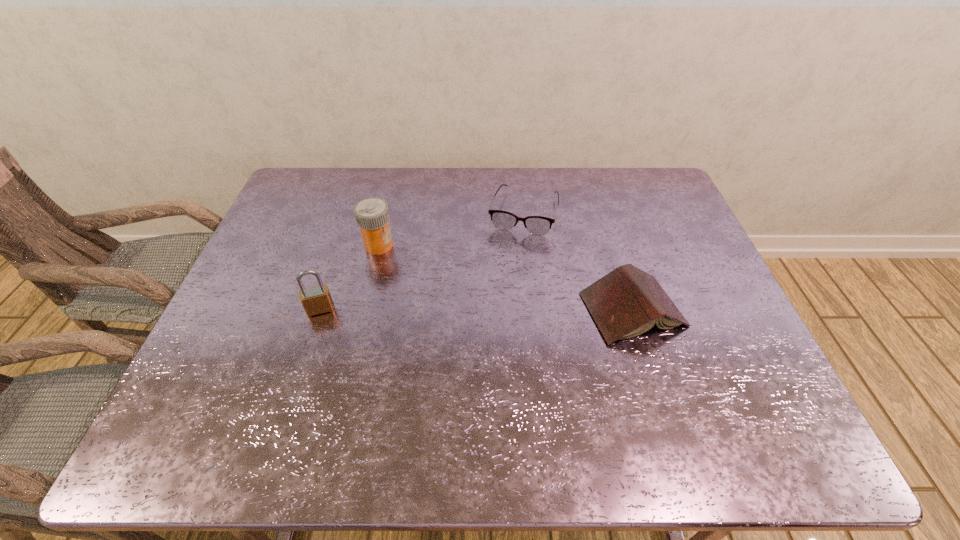
Identify which object is the second closest to the book. Please provide its 2D coordinates. Your answer should be formatted as a tuple, i.e. [(x, y)], where the tuple contains the x and y coordinates of a point satisfying the conditions above.

[(372, 215)]

Locate an element on the screen. This screenshot has height=540, width=960. free location that satisfies the following two spatial constraints: 1. on the back side of the spectacles; 2. on the left side of the third object from right to left is located at coordinates (387, 212).

I want to click on free location that satisfies the following two spatial constraints: 1. on the back side of the third object from left to right; 2. on the right side of the medicine, so click(387, 212).